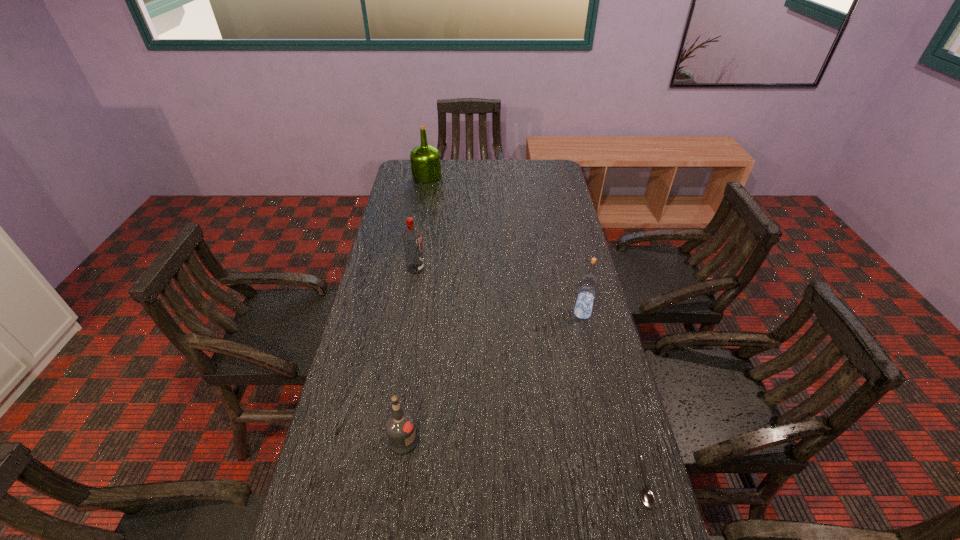
This screenshot has height=540, width=960. Find the location of `free spot located on the front label of the second nearest object`. free spot located on the front label of the second nearest object is located at coordinates pyautogui.click(x=513, y=441).

Find the location of a particular element. This screenshot has height=540, width=960. vacant space located on the left of the shortest object is located at coordinates (565, 483).

Find the location of a particular element. The height and width of the screenshot is (540, 960). object at the far edge is located at coordinates [x=425, y=159].

In order to click on olive oil that is at the left edge in this screenshot , I will do `click(425, 159)`.

Locate an element on the screen. vodka positioned at the right edge is located at coordinates pos(588,284).

Where is `soupspoon present at the right edge`? The width and height of the screenshot is (960, 540). soupspoon present at the right edge is located at coordinates (647, 498).

Locate an element on the screen. object present at the far left corner is located at coordinates (x=425, y=159).

Find the location of a particular element. This screenshot has width=960, height=540. vacant region at the left edge of the desktop is located at coordinates (387, 262).

I want to click on free location at the right edge of the desktop, so click(567, 232).

You are a GUI agent. You are given a task and a screenshot of the screen. Output one action in this format:
    pyautogui.click(x=<x>, y=<y>)
    Task: Click on the free spot at the far left corner of the desktop
    The image size is (960, 540).
    Given the screenshot: What is the action you would take?
    pyautogui.click(x=407, y=162)